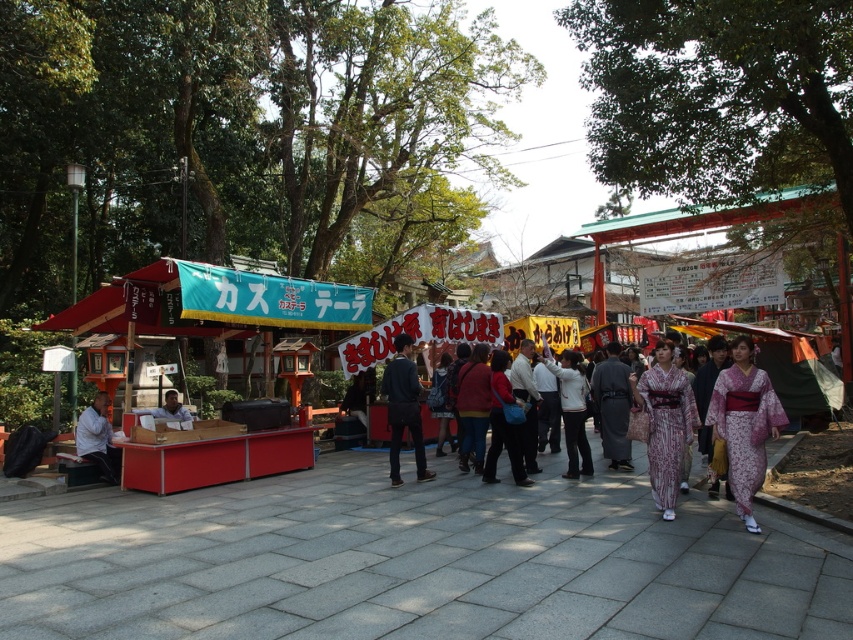
You are a photographer at the market and want to capture both the patterned kimono at center and the white matte jacket at center in a single shot. Which clothing item should you focus on first to ensure both are in frame?

The patterned kimono at center is located above the white matte jacket at center, so focusing on the patterned kimono at center first will ensure both are captured in the frame.

You are a visitor at this market and want to take a photo of the dark gray fabric kimono at center and the white matte jacket at center. Which one is positioned lower in the scene?

The dark gray fabric kimono at center is below the white matte jacket at center, so it is positioned lower in the scene.